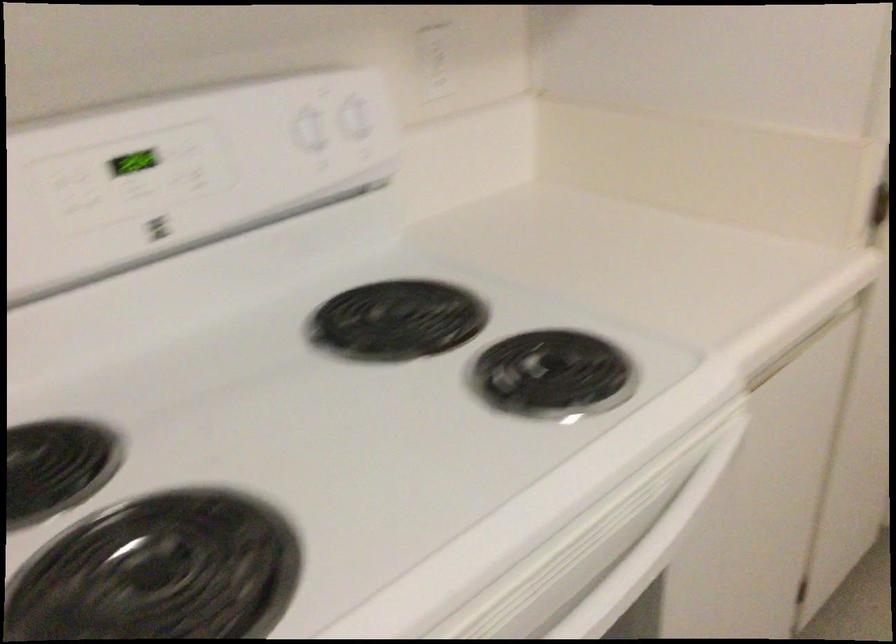
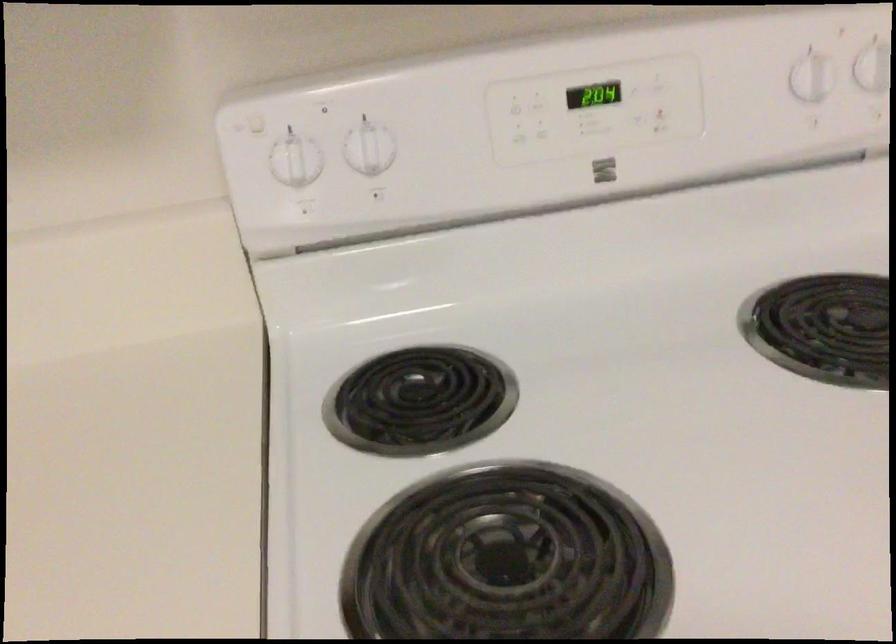
In the second image, find the point that corresponds to (x=166, y=234) in the first image.

(604, 169)